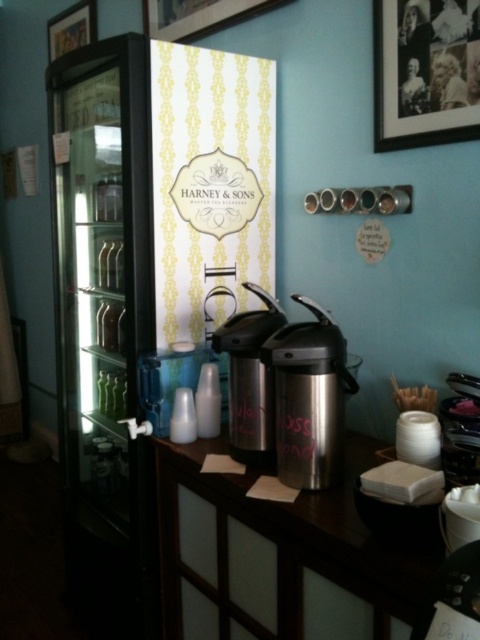
You are a customer at the tea shop and want to pour tea from the stainless steel carafe at center into the translucent plastic cup at lower center. Can you do this without moving either object?

The stainless steel carafe at center is to the right of the translucent plastic cup at lower center, so you can pour the tea without moving either object as they are positioned side by side.

You are a customer in the tea shop and want to place an order. The cashier is at the counter near the black framed glass display cabinet on the left. You are currently standing at the entrance of the shop, which is to the right of the stainless steel carafe at center. Can you walk straight to the cashier without moving around any objects?

The stainless steel carafe at center is located at point (309, 397). Since you are standing to the right of it and the cashier is near the black framed glass display cabinet on the left, walking straight would require moving towards the left. However, the carafe is positioned between you and the cashier, so you would need to move around it to reach the cashier.